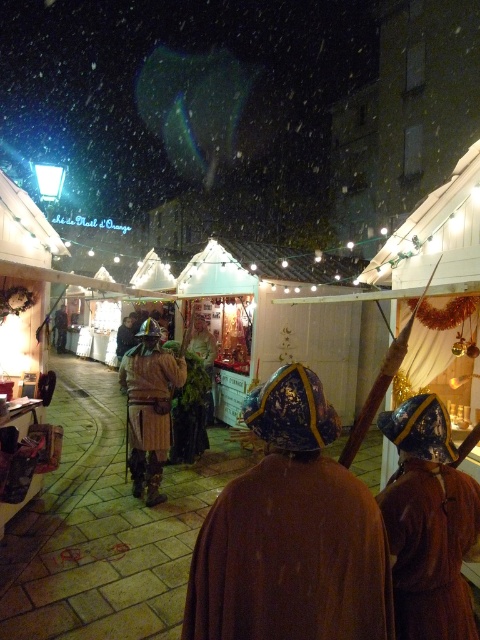
Question: Is the position of brown velvet robe at center less distant than that of brown leather armor at center?

Choices:
 (A) yes
 (B) no

Answer: (A)

Question: Can you confirm if brown woolen robe at center is positioned to the right of brown velvet robe at center?

Choices:
 (A) no
 (B) yes

Answer: (A)

Question: Based on their relative distances, which object is nearer to the brown leather armor at center?

Choices:
 (A) brown woolen robe at center
 (B) brown velvet robe at center

Answer: (B)

Question: Which object is positioned farthest from the brown velvet robe at center?

Choices:
 (A) brown woolen robe at center
 (B) brown leather armor at center

Answer: (B)

Question: Among these objects, which one is nearest to the camera?

Choices:
 (A) brown velvet robe at center
 (B) brown leather armor at center

Answer: (A)

Question: Does brown woolen robe at center have a lesser width compared to brown velvet robe at center?

Choices:
 (A) yes
 (B) no

Answer: (B)